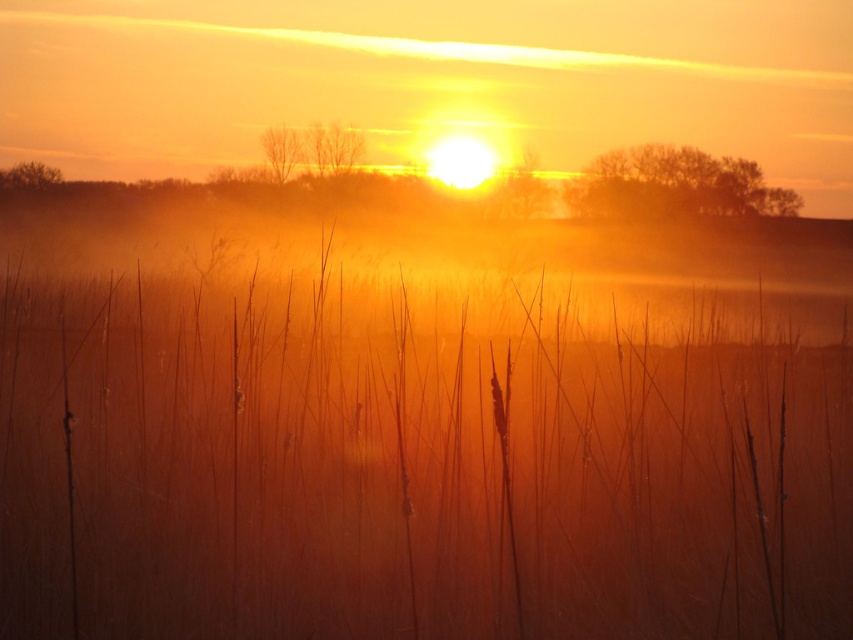
Is brown matte grass at center bigger than brown leafless tree at upper center?

Indeed, brown matte grass at center has a larger size compared to brown leafless tree at upper center.

Is brown matte grass at center closer to the viewer compared to brown leafless tree at upper center?

Yes, brown matte grass at center is closer to the viewer.

Identify the location of brown matte grass at center. (416, 444).

The height and width of the screenshot is (640, 853). I want to click on brown matte grass at center, so click(x=416, y=444).

Does foggy mist at center have a greater height compared to brown leafless tree at upper center?

Indeed, foggy mist at center has a greater height compared to brown leafless tree at upper center.

Is point (587, 22) positioned after point (669, 204)?

Yes, point (587, 22) is behind point (669, 204).

The width and height of the screenshot is (853, 640). Find the location of `foggy mist at center`. foggy mist at center is located at coordinates (428, 81).

Is translucent golden tree at upper center to the right of brown matte tree at upper left from the viewer's perspective?

Indeed, translucent golden tree at upper center is positioned on the right side of brown matte tree at upper left.

Who is positioned more to the left, translucent golden tree at upper center or brown matte tree at upper left?

brown matte tree at upper left is more to the left.

Who is more distant from viewer, (515, 177) or (25, 179)?

The point (25, 179) is behind.

You are a GUI agent. You are given a task and a screenshot of the screen. Output one action in this format:
    pyautogui.click(x=<x>, y=<y>)
    Task: Click on the translucent golden tree at upper center
    The width and height of the screenshot is (853, 640).
    Given the screenshot: What is the action you would take?
    pyautogui.click(x=519, y=189)